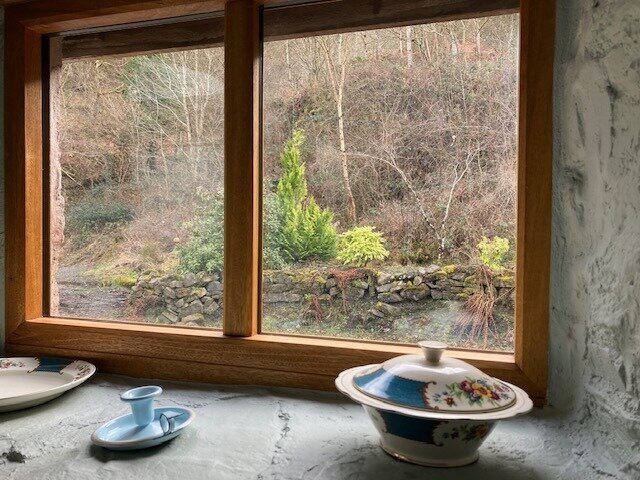
Locate an element on the screen. floral pattern on covered dish is located at coordinates (397, 428), (490, 383).